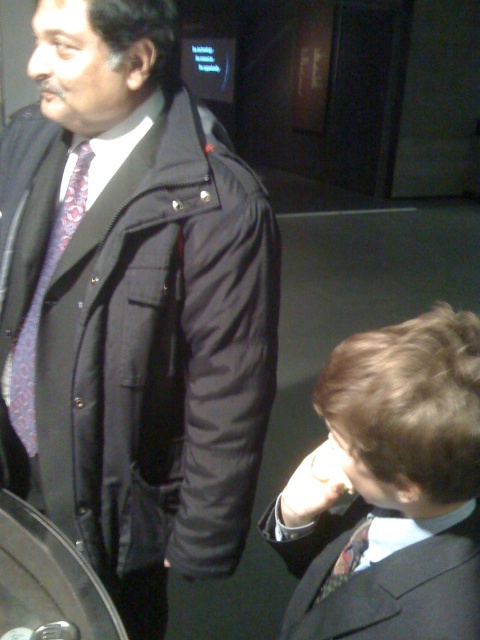
Question: Is matte black coat at center to the right of matte floral tie at left from the viewer's perspective?

Choices:
 (A) yes
 (B) no

Answer: (A)

Question: Which object is closer to the camera taking this photo?

Choices:
 (A) matte black coat at center
 (B) matte black suit at lower right
 (C) matte black tie at lower right
 (D) matte floral tie at left

Answer: (B)

Question: Estimate the real-world distances between objects in this image. Which object is farther from the matte black suit at lower right?

Choices:
 (A) matte floral tie at left
 (B) matte black tie at lower right

Answer: (A)

Question: Is matte floral tie at left positioned at the back of matte black tie at lower right?

Choices:
 (A) yes
 (B) no

Answer: (A)

Question: Among these objects, which one is nearest to the camera?

Choices:
 (A) matte floral tie at left
 (B) matte black tie at lower right
 (C) matte black suit at lower right
 (D) matte black coat at center

Answer: (C)

Question: Does matte black suit at lower right have a larger size compared to matte black tie at lower right?

Choices:
 (A) yes
 (B) no

Answer: (A)